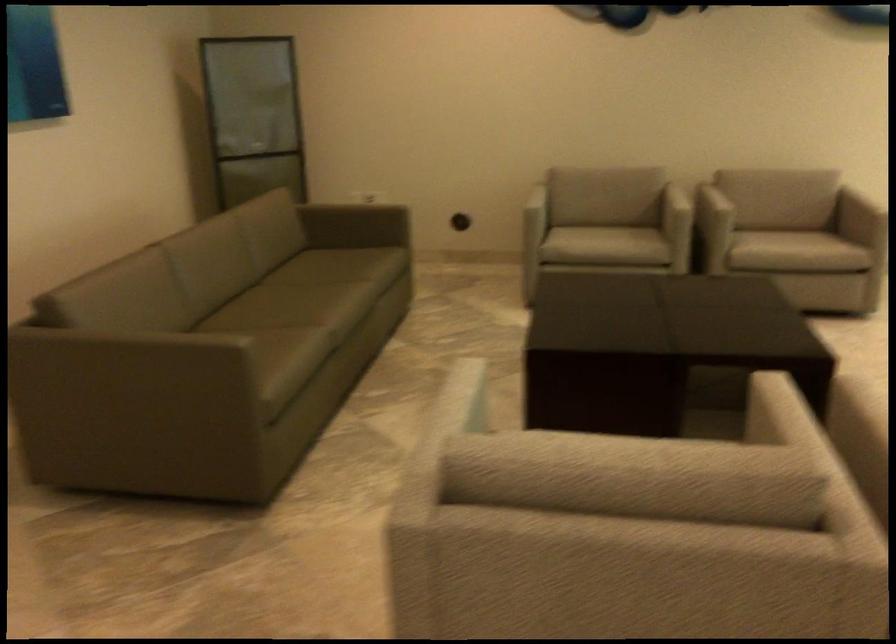
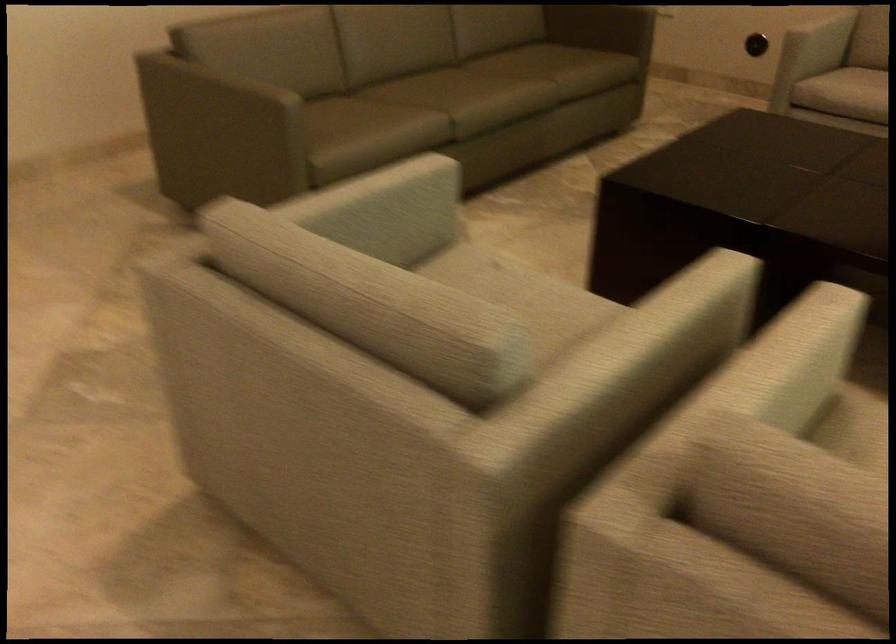
Where in the second image is the point corresponding to [332,298] from the first image?

(472, 91)